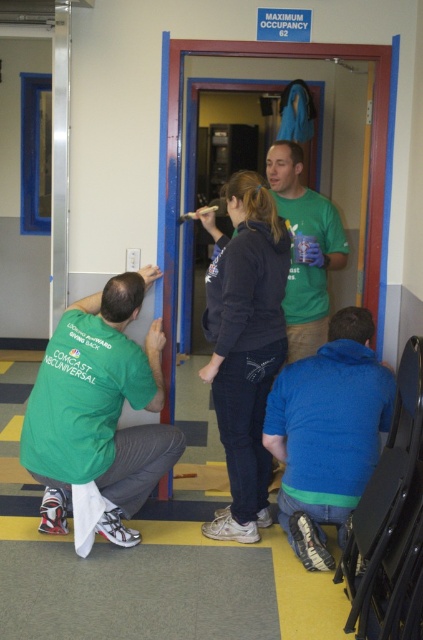
Question: Does blue fleece jacket at lower right come in front of green cotton shirt at center?

Choices:
 (A) yes
 (B) no

Answer: (A)

Question: Estimate the real-world distances between objects in this image. Which object is farther from the dark gray hoodie at center?

Choices:
 (A) green cotton shirt at center
 (B) blue fleece jacket at lower right
 (C) green matte shirt at lower left

Answer: (C)

Question: Is dark gray hoodie at center closer to the viewer compared to green cotton shirt at center?

Choices:
 (A) no
 (B) yes

Answer: (B)

Question: Does green matte shirt at lower left appear under blue fleece jacket at lower right?

Choices:
 (A) yes
 (B) no

Answer: (B)

Question: Which of the following is the closest to the observer?

Choices:
 (A) dark gray hoodie at center
 (B) green matte shirt at lower left

Answer: (B)

Question: Which of these objects is positioned farthest from the green cotton shirt at center?

Choices:
 (A) blue fleece jacket at lower right
 (B) dark gray hoodie at center

Answer: (A)